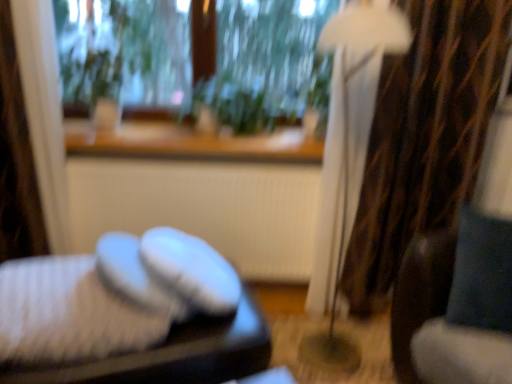
What is the approximate height of white fabric lampshade at right?

It is 1.50 meters.

At what (x,y) coordinates should I click in order to perform the action: click on white fabric lampshade at right. Please return your answer as a coordinate pair (x, y). The width and height of the screenshot is (512, 384). Looking at the image, I should click on (348, 151).

What do you see at coordinates (232, 105) in the screenshot? Image resolution: width=512 pixels, height=384 pixels. I see `green leafy plant at center` at bounding box center [232, 105].

Measure the distance between point (x=484, y=298) and camera.

Point (x=484, y=298) is 4.57 feet from camera.

This screenshot has width=512, height=384. Describe the element at coordinates (189, 143) in the screenshot. I see `wooden at upper center` at that location.

The image size is (512, 384). What are the coordinates of `white knitted socks at lower left` in the screenshot? It's located at (68, 313).

Identify the location of brown textured curtain at right. (424, 136).

In terms of size, does green leafy plant at center appear bigger or smaller than wooden at upper center?

green leafy plant at center is bigger than wooden at upper center.

Would you say green leafy plant at center is inside or outside wooden at upper center?

green leafy plant at center lies outside wooden at upper center.

Is green leafy plant at center turned away from wooden at upper center?

No, green leafy plant at center is not facing the opposite direction of wooden at upper center.

Between green leafy plant at center and wooden at upper center, which one has larger width?

Wider between the two is wooden at upper center.

Does point (27, 293) lie behind point (210, 352)?

No.

Is white knitted slippers at lower left at the back of white knitted socks at lower left?

No, white knitted slippers at lower left is not at the back of white knitted socks at lower left.

Can you confirm if white knitted socks at lower left is thinner than white knitted slippers at lower left?

Indeed, white knitted socks at lower left has a lesser width compared to white knitted slippers at lower left.

From the image's perspective, is white knitted socks at lower left positioned above or below white knitted slippers at lower left?

Clearly, from the image's perspective, white knitted socks at lower left is above white knitted slippers at lower left.

Considering the relative positions of white knitted socks at lower left and velvet blue swivel chair at right in the image provided, is white knitted socks at lower left to the right of velvet blue swivel chair at right from the viewer's perspective?

Incorrect, white knitted socks at lower left is not on the right side of velvet blue swivel chair at right.

Could velvet blue swivel chair at right be considered to be inside white knitted socks at lower left?

No, velvet blue swivel chair at right is not a part of white knitted socks at lower left.

How much distance is there between white knitted socks at lower left and velvet blue swivel chair at right?

white knitted socks at lower left and velvet blue swivel chair at right are 1.03 meters apart.

From the image's perspective, is white knitted socks at lower left located above or below velvet blue swivel chair at right?

Based on their image positions, white knitted socks at lower left is located beneath velvet blue swivel chair at right.

Does white matte radiator at center have a lesser width compared to white knitted slippers at lower left?

Indeed, white matte radiator at center has a lesser width compared to white knitted slippers at lower left.

Does white matte radiator at center have a lesser height compared to white knitted slippers at lower left?

In fact, white matte radiator at center may be taller than white knitted slippers at lower left.

Considering the positions of objects white matte radiator at center and white knitted slippers at lower left in the image provided, who is more to the right, white matte radiator at center or white knitted slippers at lower left?

white matte radiator at center.

Is the position of white matte radiator at center more distant than that of white knitted slippers at lower left?

Yes, it is behind white knitted slippers at lower left.

Which object is further away from the camera, white knitted socks at lower left or green leafy plant at center?

green leafy plant at center is further away from the camera.

Considering the points (102, 315) and (200, 102), which point is in front, point (102, 315) or point (200, 102)?

The point (102, 315) is in front.

From the picture: Are white knitted socks at lower left and green leafy plant at center located far from each other?

white knitted socks at lower left is far away from green leafy plant at center.

Considering the relative sizes of white knitted socks at lower left and green leafy plant at center in the image provided, is white knitted socks at lower left shorter than green leafy plant at center?

Yes.

This screenshot has height=384, width=512. Identify the location of table lamp located above the white matte radiator at center (from the image's perspective). pyautogui.click(x=348, y=151).

Is white matte radiator at center positioned far away from white fabric lampshade at right?

No, there isn't a large distance between white matte radiator at center and white fabric lampshade at right.

In terms of width, does white matte radiator at center look wider or thinner when compared to white fabric lampshade at right?

Considering their sizes, white matte radiator at center looks slimmer than white fabric lampshade at right.

From the picture: From the image's perspective, which is above, white matte radiator at center or white fabric lampshade at right?

From the image's view, white fabric lampshade at right is above.

Locate an element on the screen. swivel chair that is on the right side of white knitted slippers at lower left is located at coordinates (452, 284).

Could you tell me if velvet blue swivel chair at right is turned towards white knitted slippers at lower left?

No, velvet blue swivel chair at right is not facing towards white knitted slippers at lower left.

Is velvet blue swivel chair at right in front of white knitted slippers at lower left?

No, velvet blue swivel chair at right is behind white knitted slippers at lower left.

From the image's perspective, is velvet blue swivel chair at right under white knitted slippers at lower left?

No, from the image's perspective, velvet blue swivel chair at right is not beneath white knitted slippers at lower left.

Image resolution: width=512 pixels, height=384 pixels. I want to click on window sill located underneath the green leafy plant at center (from a real-world perspective), so [189, 143].

I want to click on sheet that appears in front of the white knitted slippers at lower left, so click(x=68, y=313).

From the image, which object appears to be nearer to velvet blue swivel chair at right, green leafy plant at center or white fabric lampshade at right?

Based on the image, white fabric lampshade at right appears to be nearer to velvet blue swivel chair at right.

Looking at the image, which one is located further to white fabric lampshade at right, velvet blue swivel chair at right or brown textured curtain at right?

Based on the image, velvet blue swivel chair at right appears to be further to white fabric lampshade at right.

Based on their spatial positions, is white matte radiator at center or white fabric lampshade at right further from green leafy plant at center?

Among the two, white fabric lampshade at right is located further to green leafy plant at center.

Based on their spatial positions, is wooden at upper center or velvet blue swivel chair at right closer to white knitted socks at lower left?

Based on the image, wooden at upper center appears to be nearer to white knitted socks at lower left.

Considering their positions, is white fabric lampshade at right positioned further to white knitted slippers at lower left than white matte radiator at center?

white fabric lampshade at right is further to white knitted slippers at lower left.

Based on their spatial positions, is white knitted slippers at lower left or wooden at upper center closer to green leafy plant at center?

Based on the image, wooden at upper center appears to be nearer to green leafy plant at center.

Looking at the image, which one is located closer to velvet blue swivel chair at right, wooden at upper center or white knitted slippers at lower left?

white knitted slippers at lower left is closer to velvet blue swivel chair at right.

When comparing their distances from wooden at upper center, does white matte radiator at center or white knitted slippers at lower left seem closer?

Among the two, white matte radiator at center is located nearer to wooden at upper center.

This screenshot has width=512, height=384. In order to click on window sill positioned between white fabric lampshade at right and white matte radiator at center from near to far in this screenshot , I will do `click(189, 143)`.

Locate an element on the screen. Image resolution: width=512 pixels, height=384 pixels. table lamp located between wooden at upper center and brown textured curtain at right in the left-right direction is located at coordinates (348, 151).

I want to click on radiator between white knitted socks at lower left and brown textured curtain at right from left to right, so click(204, 208).

The width and height of the screenshot is (512, 384). What are the coordinates of `plant between white matte radiator at center and brown textured curtain at right from left to right` in the screenshot? It's located at (232, 105).